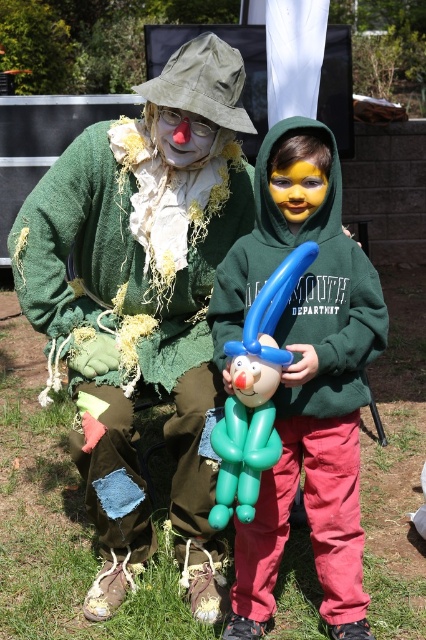
Question: Is matte green hoodie at center to the left of matte clown nose at center from the viewer's perspective?

Choices:
 (A) no
 (B) yes

Answer: (A)

Question: Which point is farther to the camera?

Choices:
 (A) matte green hoodie at center
 (B) green rubber balloon animal at center
 (C) ripped green sweater at center

Answer: (C)

Question: Among these objects, which one is nearest to the camera?

Choices:
 (A) matte green hoodie at center
 (B) yellow matte face at center

Answer: (A)

Question: Does matte green hoodie at center lie behind matte clown nose at center?

Choices:
 (A) no
 (B) yes

Answer: (A)

Question: Does ripped green sweater at center have a larger size compared to matte green hoodie at center?

Choices:
 (A) no
 (B) yes

Answer: (B)

Question: Which point appears closest to the camera in this image?

Choices:
 (A) [181, 168]
 (B) [210, 164]
 (C) [249, 467]

Answer: (C)